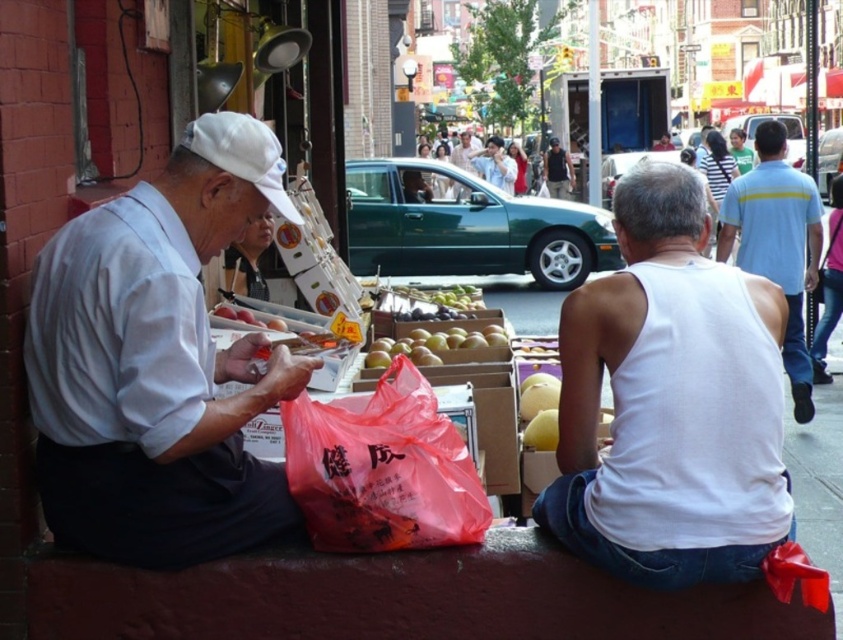
You are a street artist observing the scene. You notice two men sitting on a low wall. Which man is positioned lower in elevation compared to the other? The men are wearing a white matte shirt at left and a matte white shirt at center.

The white matte shirt at left is positioned below the matte white shirt at center, so the man wearing the white matte shirt at left is lower in elevation.

You are a fashion designer analyzing this street scene. You need to determine which clothing item, the light blue striped shirt at right or the dark blue jeans at center, is bigger in size. Based on the scene description, which one is larger?

The light blue striped shirt at right has a larger size compared to the dark blue jeans at center, so the light blue striped shirt at right is bigger.

You are taking a photo of the street scene and want to focus on both point (405, 346) and point (745, 172). Which point should you focus on first to ensure both are in sharp focus?

You should focus on point (405, 346) first because it is closer to the camera than point (745, 172). By focusing on the closer point, the farther point will also be within the depth of field and in sharp focus.